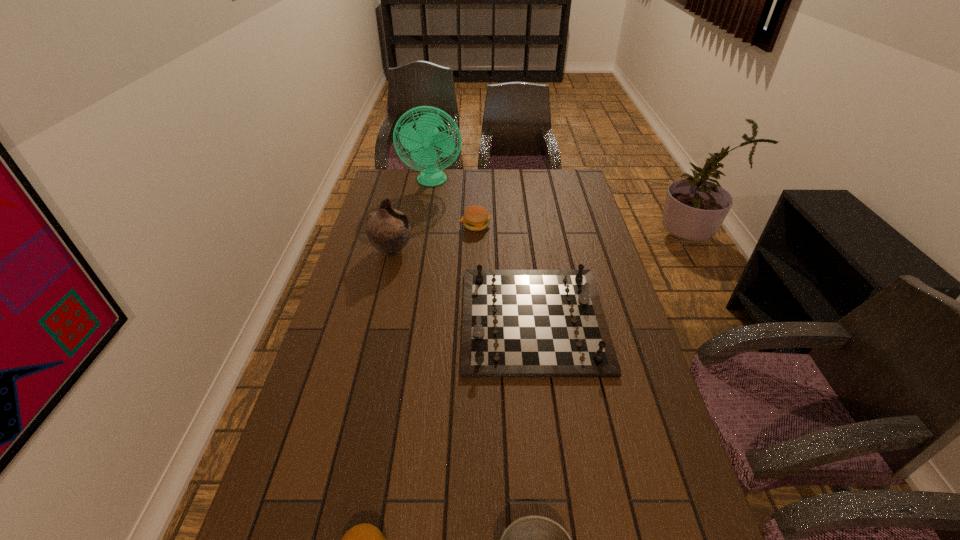
I want to click on fan, so click(426, 135).

Image resolution: width=960 pixels, height=540 pixels. What are the coordinates of `the farthest object` in the screenshot? It's located at (426, 135).

Locate an element on the screen. the fourth nearest object is located at coordinates (388, 230).

Locate an element on the screen. This screenshot has width=960, height=540. the fifth shortest object is located at coordinates (388, 230).

This screenshot has width=960, height=540. In order to click on chessboard in this screenshot , I will do `click(516, 323)`.

Find the location of a particular element. the second farthest object is located at coordinates (475, 218).

The image size is (960, 540). Find the location of `the farther hamburger`. the farther hamburger is located at coordinates (475, 218).

Where is `vacant space located 0.210m in front of the tallest object to blow air`? The height and width of the screenshot is (540, 960). vacant space located 0.210m in front of the tallest object to blow air is located at coordinates (426, 219).

Identify the location of free location located 0.140m from the spout of the fifth shortest object. (452, 251).

What are the coordinates of `vacant region located on the board of the third nearest object` in the screenshot? It's located at (446, 320).